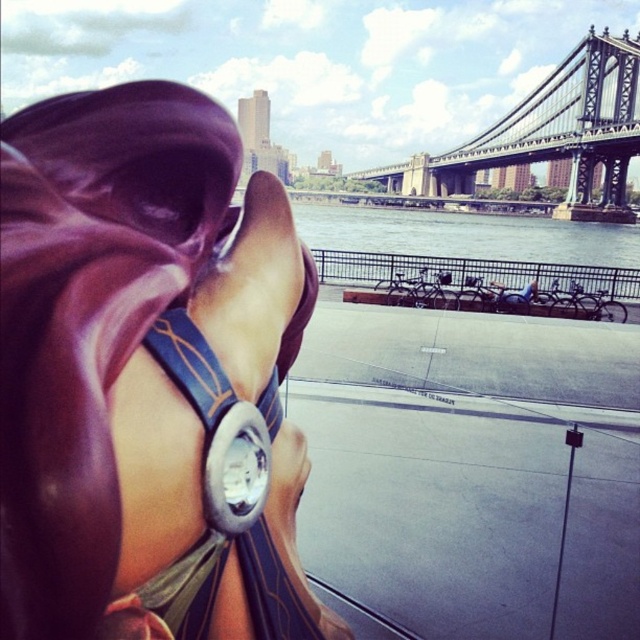
The width and height of the screenshot is (640, 640). Find the location of `leather/embossed belt at center`. leather/embossed belt at center is located at coordinates (225, 497).

Does leather/embossed belt at center appear on the left side of black metal bridge at upper right?

Correct, you'll find leather/embossed belt at center to the left of black metal bridge at upper right.

Is point (196, 561) in front of point (625, 74)?

Yes, point (196, 561) is in front of point (625, 74).

You are a GUI agent. You are given a task and a screenshot of the screen. Output one action in this format:
    pyautogui.click(x=<x>, y=<y>)
    Task: Click on the leather/embossed belt at center
    This screenshot has height=640, width=640.
    Given the screenshot: What is the action you would take?
    pyautogui.click(x=225, y=497)

Does leather-like bikini top at center have a smaller size compared to gray water at center?

Indeed, leather-like bikini top at center has a smaller size compared to gray water at center.

Can you confirm if leather-like bikini top at center is positioned above gray water at center?

No, leather-like bikini top at center is not above gray water at center.

Image resolution: width=640 pixels, height=640 pixels. In order to click on leather-like bikini top at center in this screenshot , I will do `click(147, 376)`.

Does leather-like bikini top at center come in front of leather/embossed belt at center?

Yes, it is in front of leather/embossed belt at center.

Describe the element at coordinates (147, 376) in the screenshot. I see `leather-like bikini top at center` at that location.

This screenshot has height=640, width=640. Find the location of `leather-like bikini top at center`. leather-like bikini top at center is located at coordinates (147, 376).